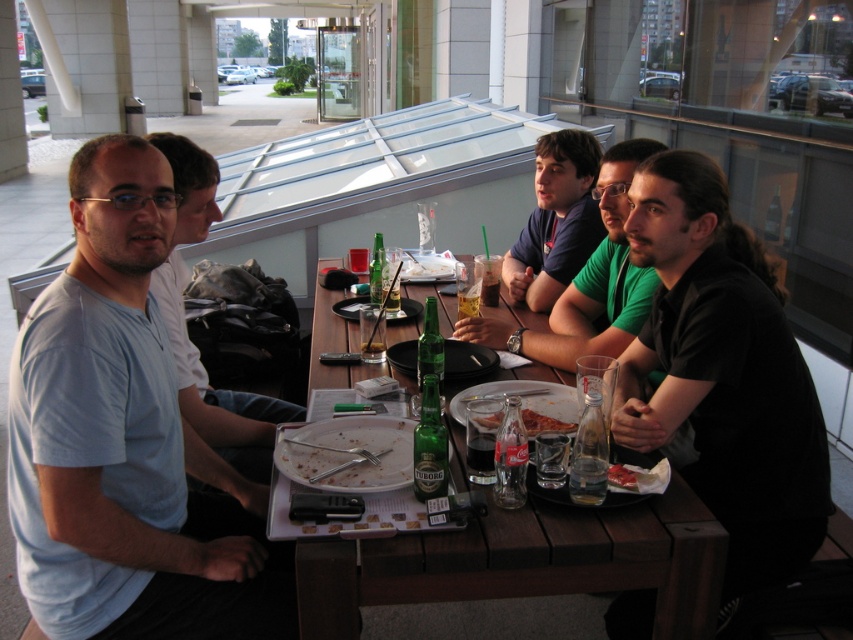
Between light blue cotton shirt at left and green glass beer bottle at table center, which one has more height?

With more height is light blue cotton shirt at left.

You are a GUI agent. You are given a task and a screenshot of the screen. Output one action in this format:
    pyautogui.click(x=<x>, y=<y>)
    Task: Click on the light blue cotton shirt at left
    
    Given the screenshot: What is the action you would take?
    pyautogui.click(x=126, y=442)

Find the location of a particular element. light blue cotton shirt at left is located at coordinates (126, 442).

Image resolution: width=853 pixels, height=640 pixels. Describe the element at coordinates (126, 442) in the screenshot. I see `light blue cotton shirt at left` at that location.

Find the location of `light blue cotton shirt at left`. light blue cotton shirt at left is located at coordinates click(x=126, y=442).

Does clear glass water at table center lie behind crumbly pizza at center?

No, it is in front of crumbly pizza at center.

The image size is (853, 640). Describe the element at coordinates (587, 480) in the screenshot. I see `clear glass water at table center` at that location.

Locate an element on the screen. This screenshot has height=640, width=853. clear glass water at table center is located at coordinates (587, 480).